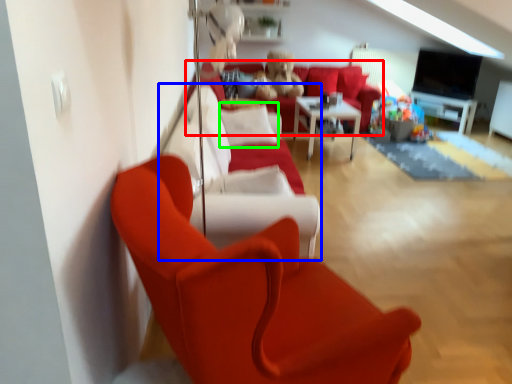
Question: Which is farther away from studio couch (highlighted by a red box)? couch (highlighted by a blue box) or pillow (highlighted by a green box)?

Choices:
 (A) couch
 (B) pillow

Answer: (A)